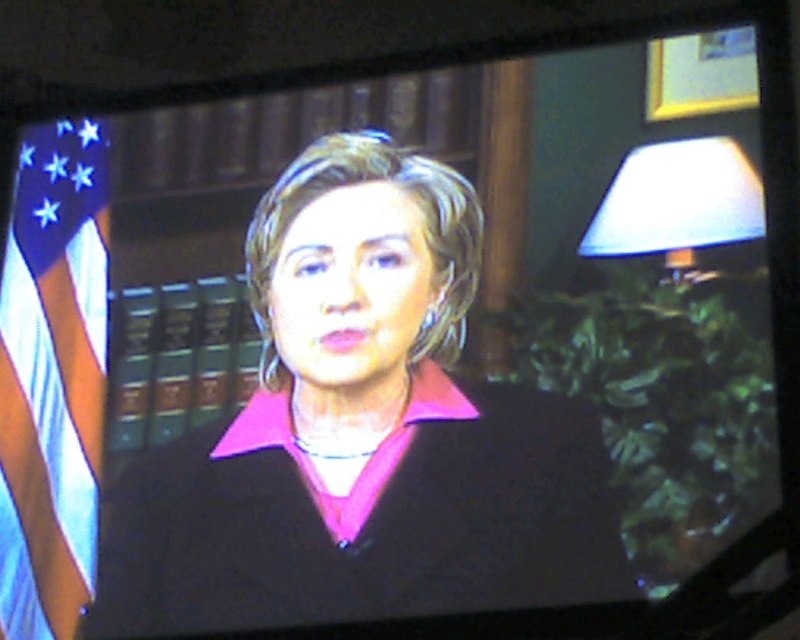
Question: Does pink matte jacket at center appear on the right side of blue fabric flag at left?

Choices:
 (A) yes
 (B) no

Answer: (A)

Question: Based on their relative distances, which object is nearer to the blue fabric flag at left?

Choices:
 (A) white fabric lampshade at upper right
 (B) pink matte jacket at center

Answer: (B)

Question: Does pink matte jacket at center appear under blue fabric flag at left?

Choices:
 (A) yes
 (B) no

Answer: (A)

Question: Which of the following is the closest to the observer?

Choices:
 (A) (613, 586)
 (B) (10, 480)
 (C) (692, 138)

Answer: (A)

Question: Considering the real-world distances, which object is farthest from the pink matte jacket at center?

Choices:
 (A) blue fabric flag at left
 (B) white fabric lampshade at upper right

Answer: (B)

Question: Can you confirm if pink matte jacket at center is thinner than white fabric lampshade at upper right?

Choices:
 (A) no
 (B) yes

Answer: (A)